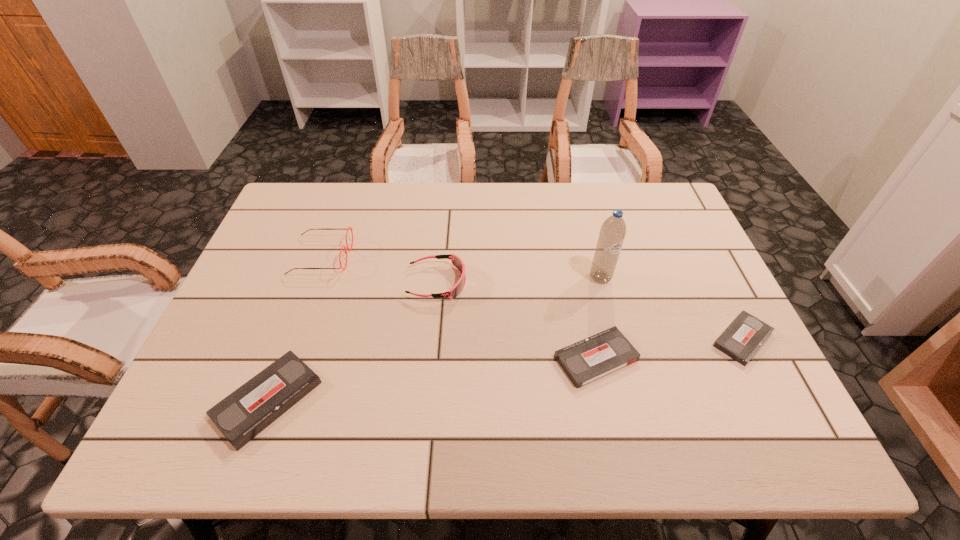
The width and height of the screenshot is (960, 540). Identify the location of empty location between the second shortest videotape and the spectacles. (459, 307).

Image resolution: width=960 pixels, height=540 pixels. I want to click on vacant area that lies between the rightmost object and the leftmost videotape, so click(x=505, y=370).

Locate an element on the screen. The height and width of the screenshot is (540, 960). free point between the leftmost videotape and the rightmost object is located at coordinates (505, 370).

Identify the location of free space between the tallest object and the fifth tallest object. (598, 318).

I want to click on vacant space in between the fourth object from right to left and the second shortest object, so click(516, 320).

I want to click on free spot between the second shortest videotape and the second tallest object, so click(x=459, y=307).

Find the location of a particular element. free space between the spectacles and the second shortest object is located at coordinates (459, 307).

Locate an element on the screen. This screenshot has height=540, width=960. the closest object to the water bottle is located at coordinates (592, 358).

This screenshot has height=540, width=960. Identify the location of the third closest object to the fifth tallest object. (457, 261).

Locate which videotape is the closest to the third object from left to right. Please provide its 2D coordinates. Your answer should be formatted as a tuple, i.e. [(x, y)], where the tuple contains the x and y coordinates of a point satisfying the conditions above.

[(246, 412)]